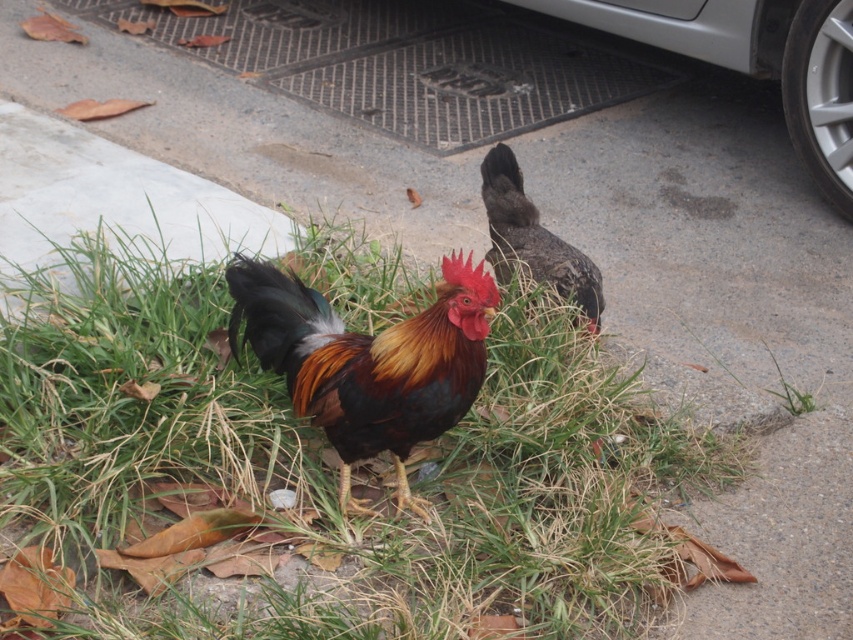
Question: Observing the image, what is the correct spatial positioning of bright orange and black feathers at center in reference to dark brown feathers at center?

Choices:
 (A) below
 (B) above

Answer: (A)

Question: In this image, where is green grass at center located relative to bright orange and black feathers at center?

Choices:
 (A) below
 (B) above

Answer: (A)

Question: Which object appears farthest from the camera in this image?

Choices:
 (A) bright orange and black feathers at center
 (B) green grass at center

Answer: (A)

Question: Estimate the real-world distances between objects in this image. Which object is farther from the bright orange and black feathers at center?

Choices:
 (A) dark brown feathers at center
 (B) green grass at center

Answer: (A)

Question: Which point appears closest to the camera in this image?

Choices:
 (A) (514, 186)
 (B) (471, 460)
 (C) (312, 340)

Answer: (C)

Question: Does green grass at center appear over bright orange and black feathers at center?

Choices:
 (A) yes
 (B) no

Answer: (B)